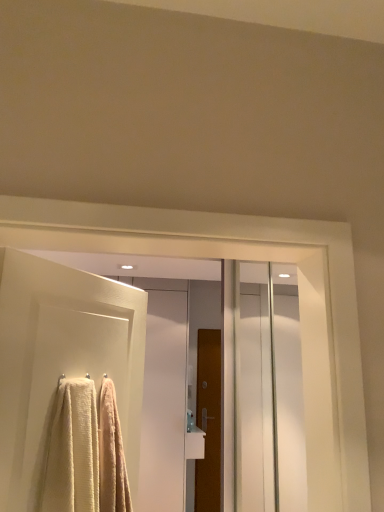
Locate an element on the screen. This screenshot has width=384, height=512. white glossy screen door at center is located at coordinates (164, 404).

In the scene shown: What is the approximate height of brown wooden door at center, placed as the first door when sorted from right to left?

It is 6.44 feet.

The image size is (384, 512). What do you see at coordinates (62, 358) in the screenshot? I see `white textured towel at left, which ranks as the 2th door in right-to-left order` at bounding box center [62, 358].

Locate an element on the screen. white glossy screen door at center is located at coordinates (164, 404).

What's the angular difference between white glossy screen door at center and soft white towel at left's facing directions?

white glossy screen door at center and soft white towel at left are facing 56.5 degrees away from each other.

Is white glossy screen door at center at the left side of soft white towel at left?

Indeed, white glossy screen door at center is positioned on the left side of soft white towel at left.

Is white glossy screen door at center positioned far away from soft white towel at left?

Absolutely, white glossy screen door at center is distant from soft white towel at left.

From the image's perspective, is white glossy screen door at center under soft white towel at left?

Indeed, from the image's perspective, white glossy screen door at center is shown beneath soft white towel at left.

Based on the photo, is white glossy screen door at center looking in the opposite direction of white textured towel at left, the first door in the front-to-back sequence?

white glossy screen door at center does not have its back to white textured towel at left, the first door in the front-to-back sequence.

This screenshot has height=512, width=384. Find the location of `door above the white glossy screen door at center (from a real-world perspective)`. door above the white glossy screen door at center (from a real-world perspective) is located at coordinates (x=62, y=358).

Is white textured towel at left, which is the first door in top-to-bottom order, inside white glossy screen door at center?

No, white textured towel at left, which is the first door in top-to-bottom order, is not a part of white glossy screen door at center.

Can you tell me how much white glossy screen door at center and white textured towel at left, which is the 2th door from back to front, differ in facing direction?

56.5 degrees separate the facing orientations of white glossy screen door at center and white textured towel at left, which is the 2th door from back to front.

Which object is more forward, soft white towel at left or brown wooden door at center, the 2th door viewed from the top?

soft white towel at left is in front.

Where is `towel above the brown wooden door at center, which is the second door in front-to-back order (from the image's perspective)`? Image resolution: width=384 pixels, height=512 pixels. towel above the brown wooden door at center, which is the second door in front-to-back order (from the image's perspective) is located at coordinates (72, 451).

Which of these two, soft white towel at left or brown wooden door at center, the 2th door viewed from the top, is wider?

soft white towel at left is wider.

Is soft white towel at left facing away from brown wooden door at center, placed as the first door when sorted from right to left?

soft white towel at left does not have its back to brown wooden door at center, placed as the first door when sorted from right to left.

From a real-world perspective, is brown wooden door at center, placed as the first door when sorted from right to left, under soft white towel at left?

Yes, from a real-world perspective, brown wooden door at center, placed as the first door when sorted from right to left, is beneath soft white towel at left.

Is brown wooden door at center, the 2th door viewed from the top, not within soft white towel at left?

Yes, brown wooden door at center, the 2th door viewed from the top, is located beyond the bounds of soft white towel at left.

Which object is wider, brown wooden door at center, which ranks as the second door in left-to-right order, or soft white towel at left?

With larger width is soft white towel at left.

From the image's perspective, is brown wooden door at center, the 2th door viewed from the top, positioned above or below soft white towel at left?

Clearly, from the image's perspective, brown wooden door at center, the 2th door viewed from the top, is below soft white towel at left.

Which object is closer to the camera taking this photo, soft white towel at left or white glossy screen door at center?

soft white towel at left is closer to the camera.

Based on the photo, which of these two, soft white towel at left or white glossy screen door at center, stands taller?

With more height is white glossy screen door at center.

Which is more to the right, soft white towel at left or white glossy screen door at center?

Positioned to the right is soft white towel at left.

Is soft white towel at left oriented away from white glossy screen door at center?

No.

From the image's perspective, is white textured towel at left, the first door in the front-to-back sequence, located above or below white glossy screen door at center?

white textured towel at left, the first door in the front-to-back sequence, is above white glossy screen door at center.

Is point (44, 262) more distant than point (154, 469)?

No, it is not.

Is white textured towel at left, which is the first door in top-to-bottom order, in front of or behind white glossy screen door at center in the image?

Visually, white textured towel at left, which is the first door in top-to-bottom order, is located in front of white glossy screen door at center.

Can white glossy screen door at center be found inside white textured towel at left, the 1th door viewed from the left?

No, white glossy screen door at center is not a part of white textured towel at left, the 1th door viewed from the left.

From the picture: Considering the sizes of soft white towel at left and white textured towel at left, arranged as the 2th door when ordered from the bottom, in the image, is soft white towel at left bigger or smaller than white textured towel at left, arranged as the 2th door when ordered from the bottom,?

soft white towel at left is smaller than white textured towel at left, arranged as the 2th door when ordered from the bottom.

From the image's perspective, between soft white towel at left and white textured towel at left, which ranks as the 2th door in right-to-left order, which one is located above?

From the image's view, white textured towel at left, which ranks as the 2th door in right-to-left order, is above.

Can you confirm if soft white towel at left is shorter than white textured towel at left, which ranks as the 2th door in right-to-left order?

Correct, soft white towel at left is not as tall as white textured towel at left, which ranks as the 2th door in right-to-left order.

Can white textured towel at left, arranged as the 2th door when ordered from the bottom, be found inside soft white towel at left?

Actually, white textured towel at left, arranged as the 2th door when ordered from the bottom, is outside soft white towel at left.

Where is `screen door that appears below the soft white towel at left (from a real-world perspective)`? screen door that appears below the soft white towel at left (from a real-world perspective) is located at coordinates (164, 404).

Find the location of a particular element. screen door below the white textured towel at left, which is the 2th door from back to front (from the image's perspective) is located at coordinates (164, 404).

From the picture: Looking at the image, which one is located closer to soft white towel at left, brown wooden door at center, the 1th door from the bottom, or white textured towel at left, which ranks as the 2th door in right-to-left order?

Based on the image, white textured towel at left, which ranks as the 2th door in right-to-left order, appears to be nearer to soft white towel at left.

From the image, which object appears to be farther from white glossy screen door at center, brown wooden door at center, the first door when ordered from back to front, or soft white towel at left?

Based on the image, soft white towel at left appears to be further to white glossy screen door at center.

Looking at the image, which one is located further to brown wooden door at center, which ranks as the second door in left-to-right order, white textured towel at left, which is the 2th door from back to front, or soft white towel at left?

Among the two, soft white towel at left is located further to brown wooden door at center, which ranks as the second door in left-to-right order.

Looking at the image, which one is located closer to brown wooden door at center, which ranks as the second door in left-to-right order, soft white towel at left or white textured towel at left, which is the 2th door from back to front?

The object closer to brown wooden door at center, which ranks as the second door in left-to-right order, is white textured towel at left, which is the 2th door from back to front.

From the image, which object appears to be farther from soft white towel at left, white glossy screen door at center or brown wooden door at center, which ranks as the second door in left-to-right order?

The object further to soft white towel at left is brown wooden door at center, which ranks as the second door in left-to-right order.

From the image, which object appears to be farther from white textured towel at left, the 1th door viewed from the left, white glossy screen door at center or brown wooden door at center, which is the second door in front-to-back order?

brown wooden door at center, which is the second door in front-to-back order, is further to white textured towel at left, the 1th door viewed from the left.

Based on their spatial positions, is brown wooden door at center, which ranks as the second door in left-to-right order, or white textured towel at left, which is the 2th door from back to front, closer to white glossy screen door at center?

brown wooden door at center, which ranks as the second door in left-to-right order, is positioned closer to the anchor white glossy screen door at center.

From the image, which object appears to be nearer to soft white towel at left, white textured towel at left, the 1th door viewed from the left, or brown wooden door at center, the first door when ordered from back to front?

white textured towel at left, the 1th door viewed from the left, is closer to soft white towel at left.

Identify the location of screen door between soft white towel at left and brown wooden door at center, which ranks as the second door in left-to-right order, in the front-back direction. Image resolution: width=384 pixels, height=512 pixels. (164, 404).

Find the location of `towel positioned between white textured towel at left, the first door in the front-to-back sequence, and brown wooden door at center, which is the second door in front-to-back order, from near to far`. towel positioned between white textured towel at left, the first door in the front-to-back sequence, and brown wooden door at center, which is the second door in front-to-back order, from near to far is located at coordinates (72, 451).

I want to click on towel between white textured towel at left, which is the 2th door from back to front, and white glossy screen door at center in the front-back direction, so click(x=72, y=451).

Find the location of a particular element. This screenshot has height=512, width=384. screen door between white textured towel at left, which is the 2th door from back to front, and brown wooden door at center, placed as the first door when sorted from right to left, from front to back is located at coordinates (164, 404).